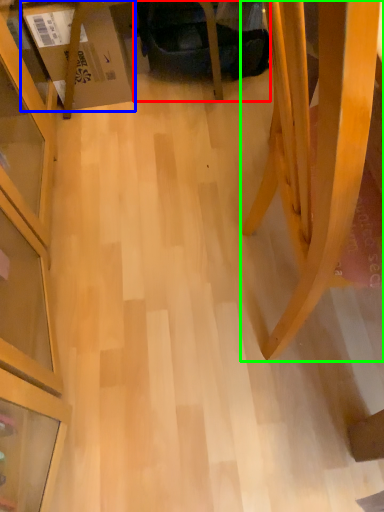
Question: Based on their relative distances, which object is nearer to swivel chair (highlighted by a red box)? Choose from cardboard box (highlighted by a blue box) and furniture (highlighted by a green box).

Choices:
 (A) cardboard box
 (B) furniture

Answer: (A)